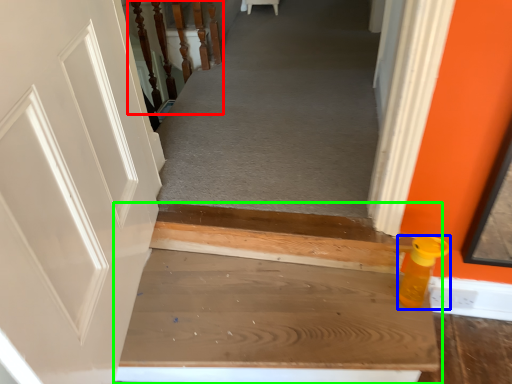
Question: Which is farther away from rail (highlighted by a red box)? bottle (highlighted by a blue box) or stairs (highlighted by a green box)?

Choices:
 (A) bottle
 (B) stairs

Answer: (A)